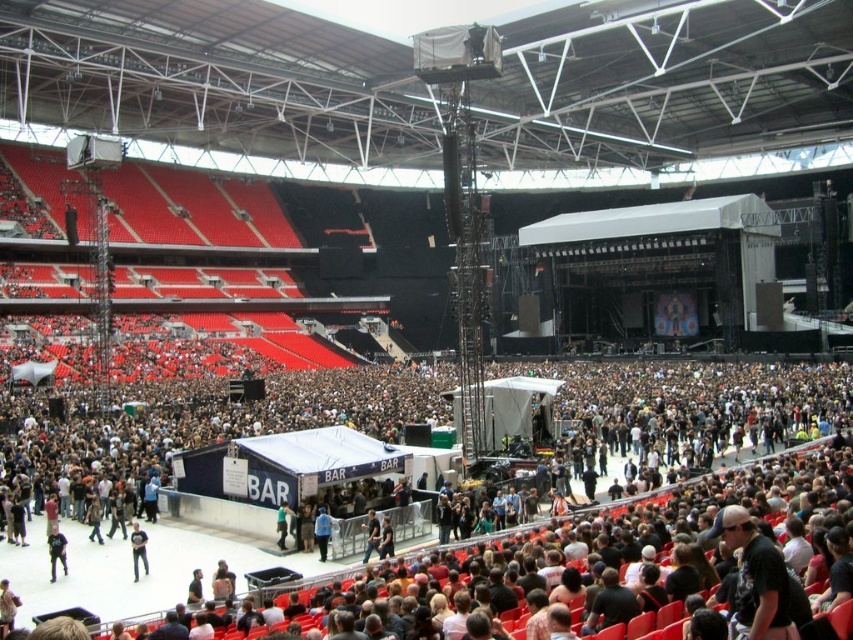
Does point (329, 534) come closer to viewer compared to point (134, 554)?

No, (329, 534) is behind (134, 554).

Who is positioned more to the left, blue fabric jacket at center or dark gray t-shirt at center?

From the viewer's perspective, dark gray t-shirt at center appears more on the left side.

Does point (329, 522) come in front of point (140, 544)?

No, it is behind (140, 544).

Find the location of a particular element. This screenshot has height=640, width=853. blue fabric jacket at center is located at coordinates (322, 531).

Which is behind, point (55, 564) or point (132, 550)?

Positioned behind is point (55, 564).

Which is above, black matte shirt at lower left or dark gray t-shirt at center?

dark gray t-shirt at center

The image size is (853, 640). Find the location of `black matte shirt at lower left`. black matte shirt at lower left is located at coordinates (56, 550).

Can you confirm if black matte shirt at lower left is taller than blue fabric jacket at center?

No.

Between black matte shirt at lower left and blue fabric jacket at center, which one appears on the left side from the viewer's perspective?

black matte shirt at lower left

At what (x,y) coordinates should I click in order to perform the action: click on black matte shirt at lower left. Please return your answer as a coordinate pair (x, y). The height and width of the screenshot is (640, 853). Looking at the image, I should click on (56, 550).

Where is `black matte shirt at lower left`? black matte shirt at lower left is located at coordinates (56, 550).